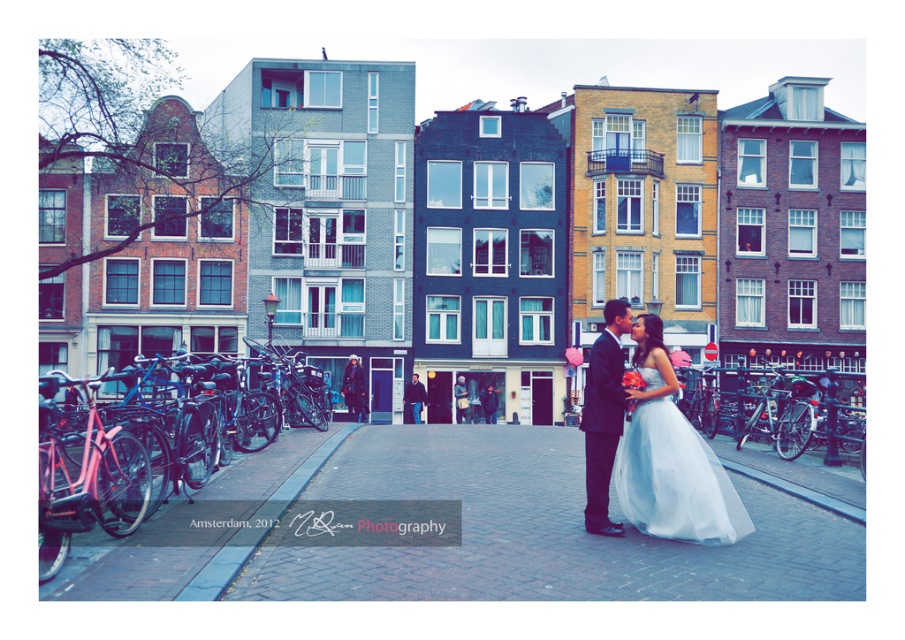
You are a photographer planning to take a photo of the two dresses displayed in the center of the street. Given that the white tulle dress at center is much taller than the white satin dress at center, which dress should be placed in the front to ensure both are fully visible in the photo?

The white satin dress at center should be placed in the front because it is shorter than the white tulle dress at center, allowing both to be fully visible in the photo.